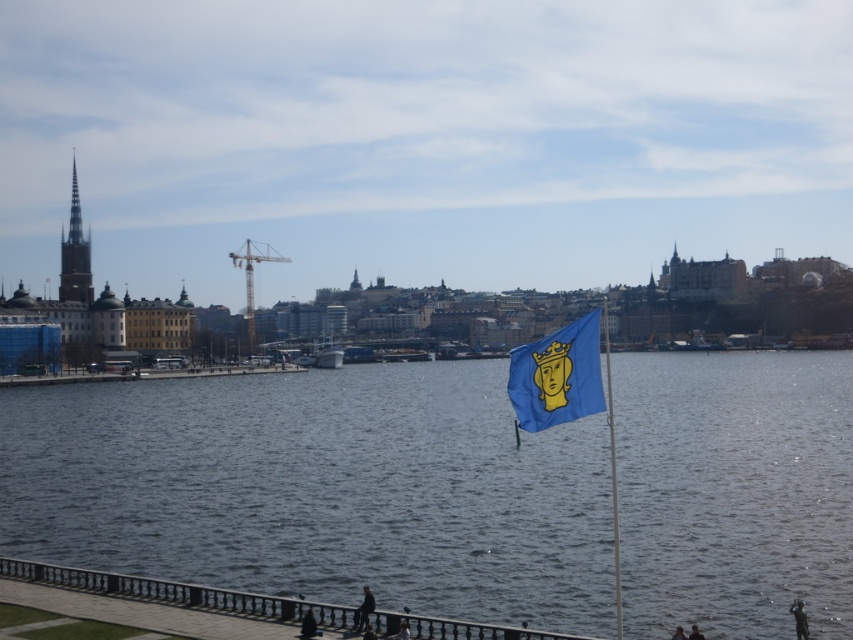
Who is positioned more to the right, blue water at center or blue fabric flag at center?

blue fabric flag at center

This screenshot has width=853, height=640. Find the location of `blue water at center`. blue water at center is located at coordinates (318, 490).

Which is in front, point (820, 582) or point (596, 387)?

Positioned in front is point (596, 387).

You are a GUI agent. You are given a task and a screenshot of the screen. Output one action in this format:
    pyautogui.click(x=<x>, y=<y>)
    Task: Click on the blue water at center
    This screenshot has width=853, height=640.
    Given the screenshot: What is the action you would take?
    pyautogui.click(x=318, y=490)

Is blue water at center above yellow metallic mast at center?

No.

In order to click on blue water at center in this screenshot , I will do 318,490.

Who is positioned more to the right, blue fabric flag at center or yellow metallic mast at center?

Positioned to the right is blue fabric flag at center.

Is the position of blue fabric flag at center less distant than that of yellow metallic mast at center?

Yes, it is.

Where is `blue fabric flag at center`? The image size is (853, 640). blue fabric flag at center is located at coordinates (556, 376).